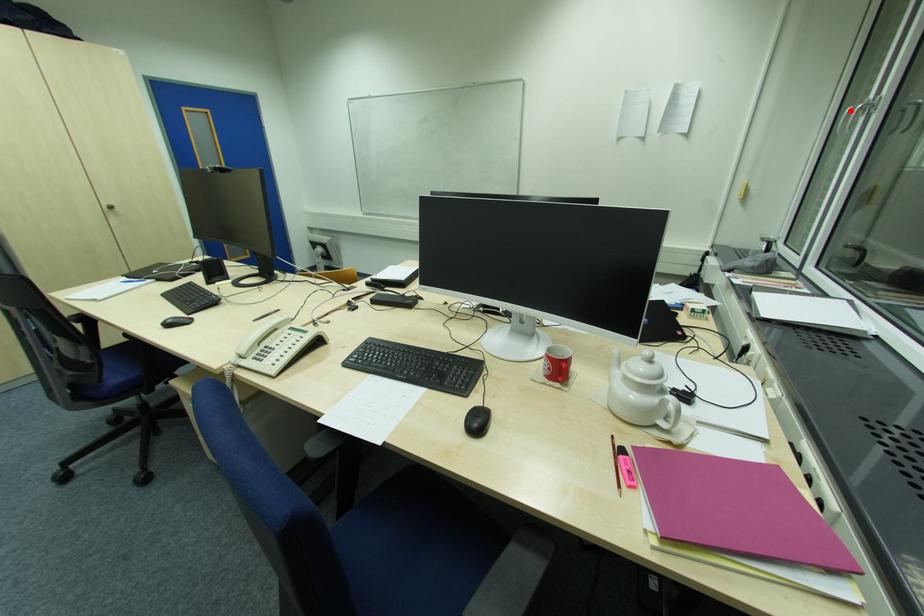
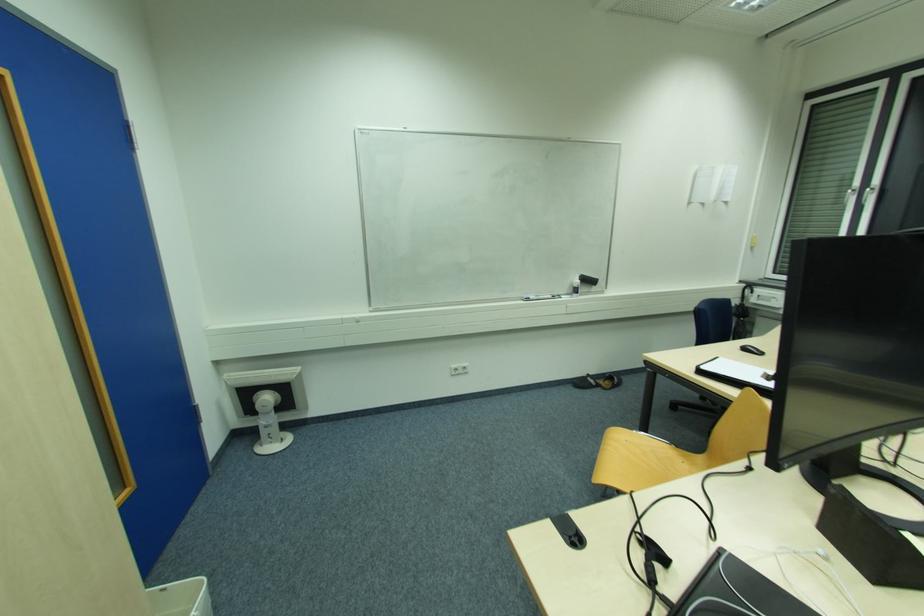
Find the pixel in the second image that matches the highlighted location in the first image.

(852, 191)